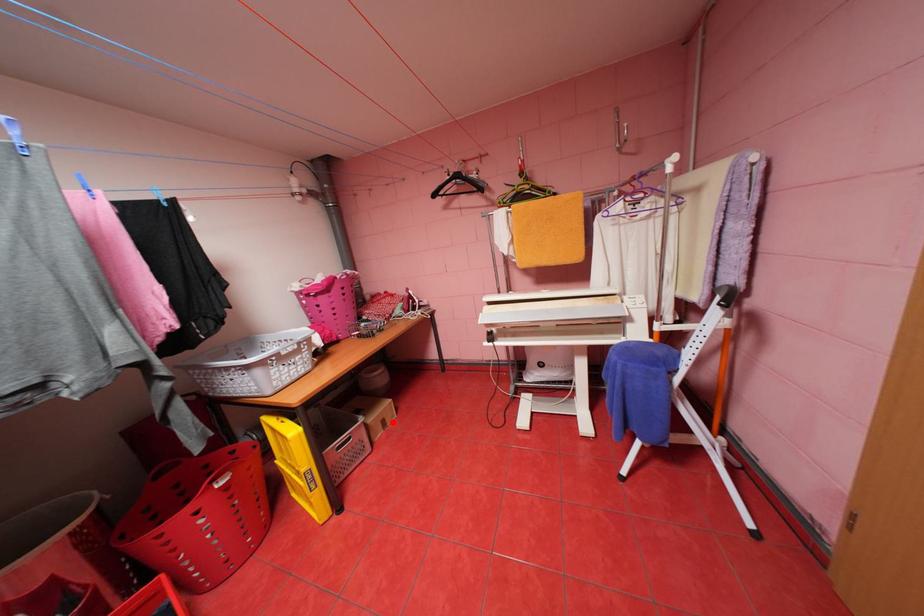
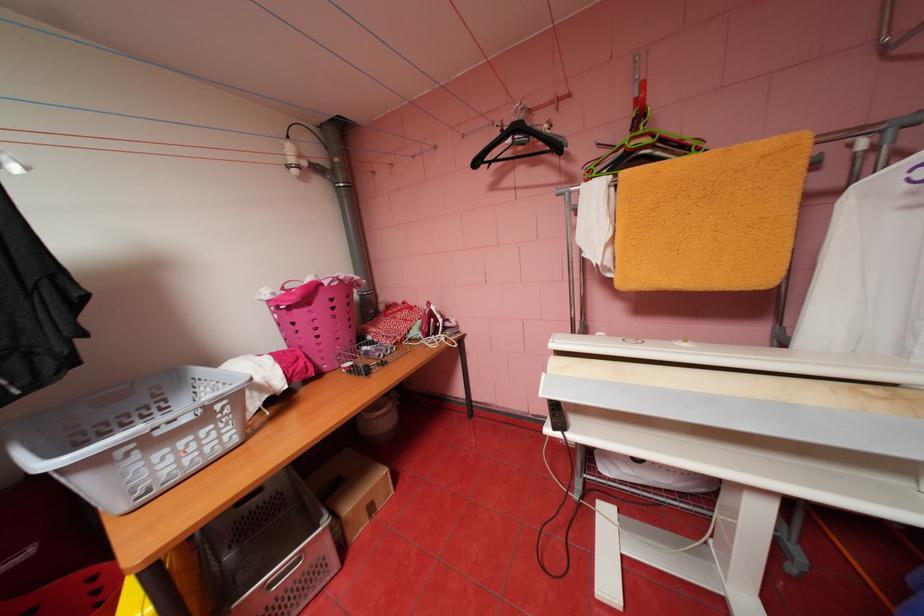
Question: I am providing you with two images of the same scene from different viewpoints. Given a red point in image1, look at the same physical point in image2. Is it:

Choices:
 (A) Closer to the viewpoint
 (B) Farther from the viewpoint

Answer: (A)